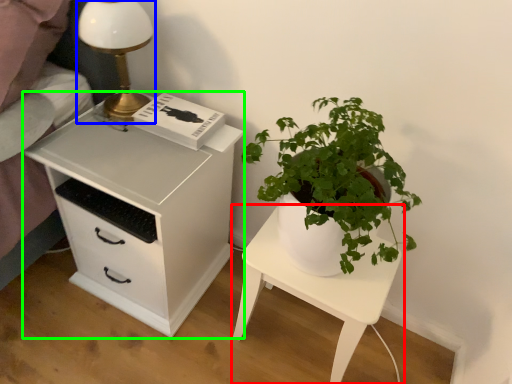
Question: Which is farther away from nightstand (highlighted by a red box)? table lamp (highlighted by a blue box) or chest of drawers (highlighted by a green box)?

Choices:
 (A) table lamp
 (B) chest of drawers

Answer: (A)